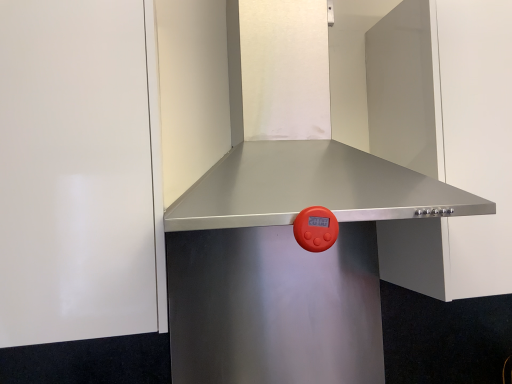
The image size is (512, 384). What are the coordinates of `stainless steel vent at center` in the screenshot? It's located at (309, 189).

I want to click on white glossy door at upper left, which appears as the 1th door when viewed from the left, so click(x=74, y=172).

Is stainless steel vent at center touching white glossy door at upper left, the second door in the right-to-left sequence?

stainless steel vent at center and white glossy door at upper left, the second door in the right-to-left sequence, are clearly separated.

Is stainless steel vent at center further to camera compared to white glossy door at upper left, which appears as the 1th door when viewed from the left?

No, the depth of stainless steel vent at center is less than that of white glossy door at upper left, which appears as the 1th door when viewed from the left.

In terms of width, does stainless steel vent at center look wider or thinner when compared to white glossy door at upper left, which appears as the 1th door when viewed from the left?

Considering their sizes, stainless steel vent at center looks broader than white glossy door at upper left, which appears as the 1th door when viewed from the left.

Can you confirm if stainless steel range hood at upper center, the 1th door viewed from the right, is wider than stainless steel vent at center?

Incorrect, the width of stainless steel range hood at upper center, the 1th door viewed from the right, does not surpass that of stainless steel vent at center.

Is stainless steel range hood at upper center, the 1th door viewed from the right, facing away from stainless steel vent at center?

No, stainless steel range hood at upper center, the 1th door viewed from the right, is not facing away from stainless steel vent at center.

From a real-world perspective, which is physically above, stainless steel range hood at upper center, placed as the second door when sorted from left to right, or stainless steel vent at center?

From a 3D spatial view, stainless steel vent at center is above.

How much distance is there between stainless steel range hood at upper center, placed as the second door when sorted from left to right, and stainless steel vent at center?

stainless steel range hood at upper center, placed as the second door when sorted from left to right, and stainless steel vent at center are 7.85 inches apart from each other.

From a real-world perspective, relative to stainless steel range hood at upper center, the 1th door viewed from the right, is white glossy door at upper left, the second door in the right-to-left sequence, vertically above or below?

Clearly, from a real-world perspective, white glossy door at upper left, the second door in the right-to-left sequence, is above stainless steel range hood at upper center, the 1th door viewed from the right.

Considering the positions of points (24, 272) and (443, 107), is point (24, 272) closer to camera compared to point (443, 107)?

Yes.

Considering the positions of objects white glossy door at upper left, the second door in the right-to-left sequence, and stainless steel range hood at upper center, the 1th door viewed from the right, in the image provided, who is more to the right, white glossy door at upper left, the second door in the right-to-left sequence, or stainless steel range hood at upper center, the 1th door viewed from the right,?

stainless steel range hood at upper center, the 1th door viewed from the right.

Considering the sizes of objects white glossy door at upper left, which appears as the 1th door when viewed from the left, and stainless steel range hood at upper center, the 1th door viewed from the right, in the image provided, who is taller, white glossy door at upper left, which appears as the 1th door when viewed from the left, or stainless steel range hood at upper center, the 1th door viewed from the right,?

Standing taller between the two is white glossy door at upper left, which appears as the 1th door when viewed from the left.

Can stainless steel vent at center be found inside white glossy door at upper left, the second door in the right-to-left sequence?

No, stainless steel vent at center is not surrounded by white glossy door at upper left, the second door in the right-to-left sequence.

Is white glossy door at upper left, which appears as the 1th door when viewed from the left, in front of or behind stainless steel vent at center in the image?

white glossy door at upper left, which appears as the 1th door when viewed from the left, is behind stainless steel vent at center.

Which is in front, point (67, 69) or point (186, 99)?

The point (67, 69) is closer.

From the image's perspective, between stainless steel range hood at upper center, the 1th door viewed from the right, and white glossy door at upper left, the second door in the right-to-left sequence, who is located below?

From the image's view, white glossy door at upper left, the second door in the right-to-left sequence, is below.

The height and width of the screenshot is (384, 512). What are the coordinates of `door on the right of white glossy door at upper left, the second door in the right-to-left sequence` in the screenshot? It's located at (446, 138).

Which object is thinner, stainless steel range hood at upper center, placed as the second door when sorted from left to right, or white glossy door at upper left, the second door in the right-to-left sequence?

With smaller width is white glossy door at upper left, the second door in the right-to-left sequence.

From a real-world perspective, between stainless steel range hood at upper center, placed as the second door when sorted from left to right, and white glossy door at upper left, the second door in the right-to-left sequence, who is vertically higher?

In real-world perspective, white glossy door at upper left, the second door in the right-to-left sequence, is above.

Considering the positions of points (265, 32) and (396, 279), is point (265, 32) closer to camera compared to point (396, 279)?

Yes, point (265, 32) is closer to viewer.

From a real-world perspective, is stainless steel vent at center physically located above or below stainless steel range hood at upper center, the 1th door viewed from the right?

stainless steel vent at center is situated higher than stainless steel range hood at upper center, the 1th door viewed from the right, in the real world.

Does stainless steel vent at center contain stainless steel range hood at upper center, placed as the second door when sorted from left to right?

No, stainless steel range hood at upper center, placed as the second door when sorted from left to right, is not a part of stainless steel vent at center.

At what (x,y) coordinates should I click in order to perform the action: click on vent that appears on the right of white glossy door at upper left, which appears as the 1th door when viewed from the left. Please return your answer as a coordinate pair (x, y). The width and height of the screenshot is (512, 384). Looking at the image, I should click on (309, 189).

Identify the location of vent in front of the stainless steel range hood at upper center, the 1th door viewed from the right. Image resolution: width=512 pixels, height=384 pixels. (309, 189).

From the image, which object appears to be nearer to white glossy door at upper left, the second door in the right-to-left sequence, stainless steel vent at center or stainless steel range hood at upper center, the 1th door viewed from the right?

Among the two, stainless steel vent at center is located nearer to white glossy door at upper left, the second door in the right-to-left sequence.

When comparing their distances from stainless steel range hood at upper center, the 1th door viewed from the right, does stainless steel vent at center or white glossy door at upper left, which appears as the 1th door when viewed from the left, seem further?

Among the two, white glossy door at upper left, which appears as the 1th door when viewed from the left, is located further to stainless steel range hood at upper center, the 1th door viewed from the right.

Considering their positions, is stainless steel range hood at upper center, placed as the second door when sorted from left to right, positioned further to white glossy door at upper left, which appears as the 1th door when viewed from the left, than stainless steel vent at center?

stainless steel range hood at upper center, placed as the second door when sorted from left to right, lies further to white glossy door at upper left, which appears as the 1th door when viewed from the left, than the other object.

From the image, which object appears to be farther from stainless steel vent at center, stainless steel range hood at upper center, the 1th door viewed from the right, or white glossy door at upper left, the second door in the right-to-left sequence?

Based on the image, white glossy door at upper left, the second door in the right-to-left sequence, appears to be further to stainless steel vent at center.

From the image, which object appears to be nearer to stainless steel vent at center, white glossy door at upper left, the second door in the right-to-left sequence, or stainless steel range hood at upper center, the 1th door viewed from the right?

Based on the image, stainless steel range hood at upper center, the 1th door viewed from the right, appears to be nearer to stainless steel vent at center.

Estimate the real-world distances between objects in this image. Which object is further from stainless steel range hood at upper center, placed as the second door when sorted from left to right, white glossy door at upper left, which appears as the 1th door when viewed from the left, or stainless steel vent at center?

white glossy door at upper left, which appears as the 1th door when viewed from the left.

You are a GUI agent. You are given a task and a screenshot of the screen. Output one action in this format:
    pyautogui.click(x=<x>, y=<y>)
    Task: Click on the vent between white glossy door at upper left, the second door in the right-to-left sequence, and stainless steel range hood at upper center, the 1th door viewed from the right, in the horizontal direction
    The image size is (512, 384).
    Given the screenshot: What is the action you would take?
    pyautogui.click(x=309, y=189)